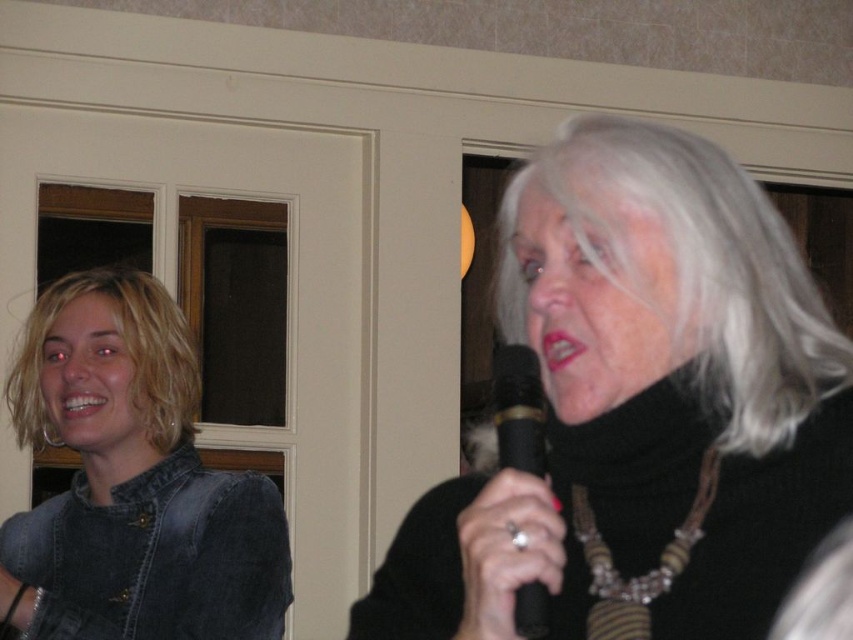
Question: Does denim jacket at left appear over blondehair at left?

Choices:
 (A) yes
 (B) no

Answer: (B)

Question: Which object appears farthest from the camera in this image?

Choices:
 (A) gray matte hair at upper right
 (B) black matte microphone at center
 (C) blondehair at left
 (D) brown wooden beads at center

Answer: (C)

Question: Among these objects, which one is nearest to the camera?

Choices:
 (A) black metallic microphone at center
 (B) black matte microphone at center
 (C) brown wooden beads at center

Answer: (B)

Question: Considering the real-world distances, which object is farthest from the denim jacket at left?

Choices:
 (A) brown wooden beads at center
 (B) gray matte hair at upper right
 (C) blondehair at left
 (D) black metallic microphone at center

Answer: (A)

Question: Observing the image, what is the correct spatial positioning of gray matte hair at upper right in reference to black metallic microphone at center?

Choices:
 (A) above
 (B) below

Answer: (A)

Question: Can you confirm if denim jacket at left is positioned below gray matte hair at upper right?

Choices:
 (A) no
 (B) yes

Answer: (B)